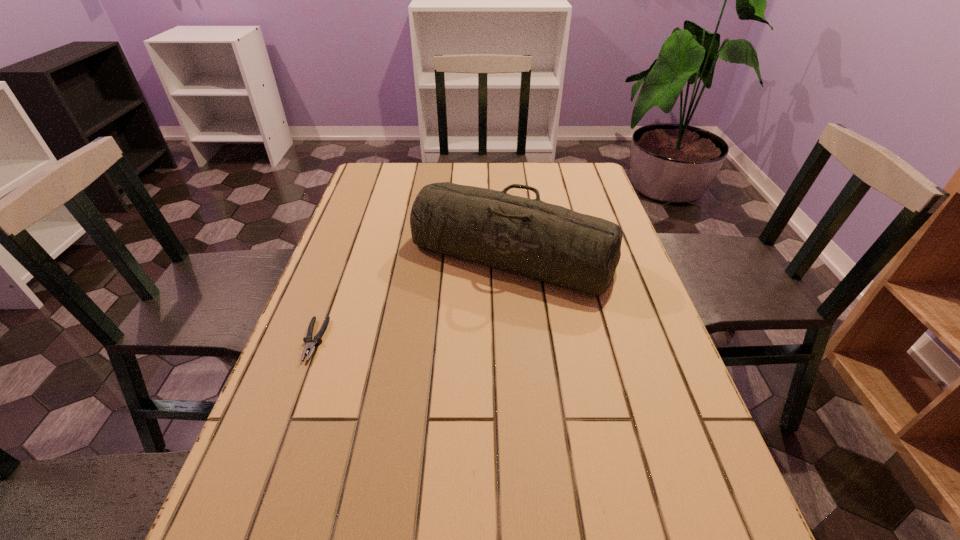
The height and width of the screenshot is (540, 960). What are the coordinates of `the right object` in the screenshot? It's located at (550, 243).

Find the location of a particular element. The width and height of the screenshot is (960, 540). the farther object is located at coordinates (550, 243).

Find the location of `pliers`. pliers is located at coordinates (310, 344).

Locate an element on the screen. The image size is (960, 540). the left object is located at coordinates (310, 344).

Image resolution: width=960 pixels, height=540 pixels. Find the location of `free space located on the front of the right object`. free space located on the front of the right object is located at coordinates tap(521, 357).

This screenshot has width=960, height=540. I want to click on vacant position located 0.110m at the gripping part of the nearer object, so (289, 410).

Image resolution: width=960 pixels, height=540 pixels. Find the location of `object situated at the left edge`. object situated at the left edge is located at coordinates (310, 344).

This screenshot has width=960, height=540. In order to click on object positioned at the right edge in this screenshot , I will do `click(550, 243)`.

In the image, there is a desktop. Where is `vacant space at the far edge`? vacant space at the far edge is located at coordinates (527, 174).

In the image, there is a desktop. Where is `vacant region at the left edge`? The height and width of the screenshot is (540, 960). vacant region at the left edge is located at coordinates (347, 251).